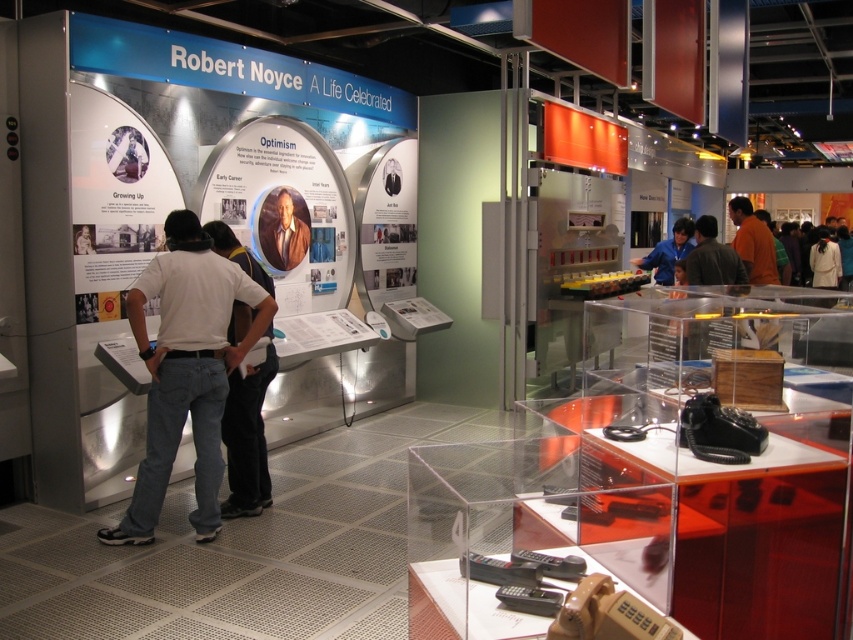
You are a visitor at the exhibition and want to see both the matte silver display at center and the matte silver poster at center. Which one should you look at first if you want to follow the natural viewing order from top to bottom?

You should look at the matte silver poster at center first because it is positioned above the matte silver display at center, following the natural top to bottom viewing order.

You are a visitor at the exhibition and want to take a photo of the white matte shirt at left and the matte silver display at center. Which object should you focus on first if you want to capture both in the same frame without moving your camera?

The white matte shirt at left is below the matte silver display at center, so you should focus on the matte silver display at center first to ensure both objects are in the frame.

You are a museum visitor who wants to take a photo of both the matte silver display at center and the matte brown suit at center. Since you want to include both in the frame, which object should you focus on to ensure both are visible?

You should focus on the matte silver display at center because it is larger than the matte brown suit at center, allowing both to fit within the camera frame more easily.